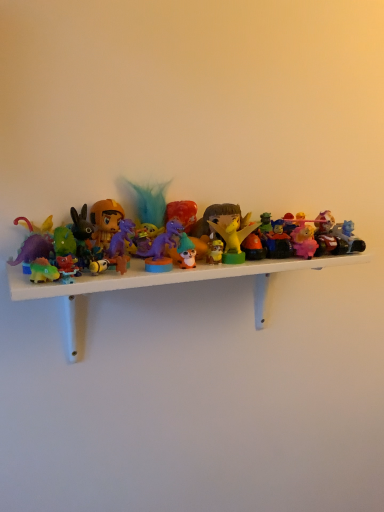
Question: Is plastic toys at center thinner than matte yellow dragon at center, positioned as the 4th toy in right-to-left order?

Choices:
 (A) no
 (B) yes

Answer: (A)

Question: Is plastic toys at center with matte yellow dragon at center, positioned as the 4th toy in right-to-left order?

Choices:
 (A) yes
 (B) no

Answer: (B)

Question: Could you tell me if plastic toys at center is turned towards matte yellow dragon at center, the 5th toy from the left?

Choices:
 (A) yes
 (B) no

Answer: (B)

Question: From the image's perspective, does plastic toys at center appear higher than matte yellow dragon at center, positioned as the 4th toy in right-to-left order?

Choices:
 (A) yes
 (B) no

Answer: (B)

Question: Does plastic toys at center come in front of matte yellow dragon at center, positioned as the 4th toy in right-to-left order?

Choices:
 (A) no
 (B) yes

Answer: (B)

Question: Would you say plastic toys at center contains matte yellow dragon at center, positioned as the 4th toy in right-to-left order?

Choices:
 (A) no
 (B) yes

Answer: (A)

Question: Is there a large distance between pink matte figurine at center-right, arranged as the second toy when viewed from the right, and matte yellow dragon at center, positioned as the 4th toy in right-to-left order?

Choices:
 (A) yes
 (B) no

Answer: (B)

Question: Is pink matte figurine at center-right, arranged as the second toy when viewed from the right, oriented towards matte yellow dragon at center, positioned as the 4th toy in right-to-left order?

Choices:
 (A) yes
 (B) no

Answer: (B)

Question: Is pink matte figurine at center-right, the 7th toy when ordered from left to right, positioned with its back to matte yellow dragon at center, the 5th toy from the left?

Choices:
 (A) no
 (B) yes

Answer: (A)

Question: Is pink matte figurine at center-right, the 7th toy when ordered from left to right, next to matte yellow dragon at center, positioned as the 4th toy in right-to-left order, and touching it?

Choices:
 (A) no
 (B) yes

Answer: (B)

Question: Is the position of pink matte figurine at center-right, the 7th toy when ordered from left to right, more distant than that of matte yellow dragon at center, positioned as the 4th toy in right-to-left order?

Choices:
 (A) yes
 (B) no

Answer: (A)

Question: Considering the relative positions of pink matte figurine at center-right, the 7th toy when ordered from left to right, and matte yellow dragon at center, the 5th toy from the left, in the image provided, is pink matte figurine at center-right, the 7th toy when ordered from left to right, to the left of matte yellow dragon at center, the 5th toy from the left, from the viewer's perspective?

Choices:
 (A) yes
 (B) no

Answer: (B)

Question: Is the position of plastic toys at center less distant than that of pink matte figurine at center-right, arranged as the second toy when viewed from the right?

Choices:
 (A) yes
 (B) no

Answer: (A)